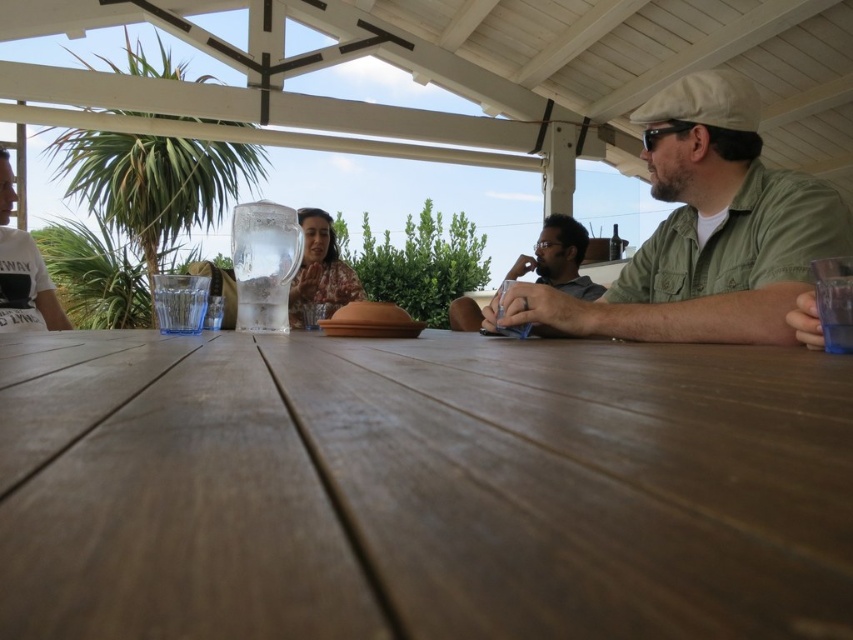
Can you confirm if brown wooden table at center is positioned below printed fabric shirt at center?

Indeed, brown wooden table at center is positioned under printed fabric shirt at center.

Where is `brown wooden table at center`? The width and height of the screenshot is (853, 640). brown wooden table at center is located at coordinates click(x=421, y=486).

This screenshot has width=853, height=640. What are the coordinates of `brown wooden table at center` in the screenshot? It's located at (421, 486).

Is brown wooden table at center smaller than matte brown shirt at center?

Correct, brown wooden table at center occupies less space than matte brown shirt at center.

From the picture: Between brown wooden table at center and matte brown shirt at center, which one has less height?

Standing shorter between the two is brown wooden table at center.

Locate an element on the screen. The height and width of the screenshot is (640, 853). brown wooden table at center is located at coordinates (421, 486).

The width and height of the screenshot is (853, 640). What do you see at coordinates (703, 230) in the screenshot?
I see `khaki cotton cap at upper right` at bounding box center [703, 230].

Who is positioned more to the left, khaki cotton cap at upper right or matte brown shirt at center?

Positioned to the left is khaki cotton cap at upper right.

Who is more distant from viewer, (633, 324) or (549, 259)?

Point (549, 259)

The width and height of the screenshot is (853, 640). I want to click on khaki cotton cap at upper right, so click(x=703, y=230).